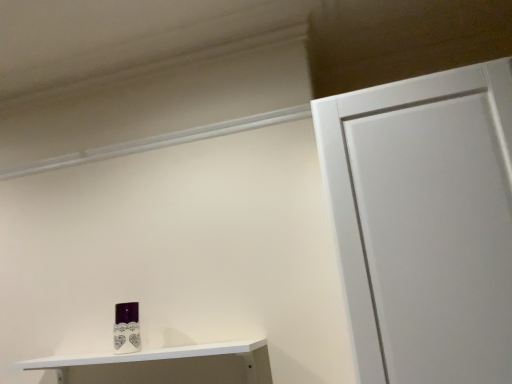
Question: Is purple glossy toiletry at lower left taller or shorter than white glossy shelf at lower left?

Choices:
 (A) tall
 (B) short

Answer: (A)

Question: Is purple glossy toiletry at lower left to the left or to the right of white glossy shelf at lower left in the image?

Choices:
 (A) right
 (B) left

Answer: (B)

Question: From the image's perspective, relative to white glossy shelf at lower left, is purple glossy toiletry at lower left above or below?

Choices:
 (A) above
 (B) below

Answer: (A)

Question: Is point (223, 355) closer or farther from the camera than point (128, 319)?

Choices:
 (A) farther
 (B) closer

Answer: (B)

Question: From a real-world perspective, is white glossy shelf at lower left positioned above or below purple glossy toiletry at lower left?

Choices:
 (A) below
 (B) above

Answer: (A)

Question: Choose the correct answer: Is white glossy shelf at lower left inside purple glossy toiletry at lower left or outside it?

Choices:
 (A) outside
 (B) inside

Answer: (A)

Question: From the image's perspective, relative to purple glossy toiletry at lower left, is white glossy shelf at lower left above or below?

Choices:
 (A) above
 (B) below

Answer: (B)